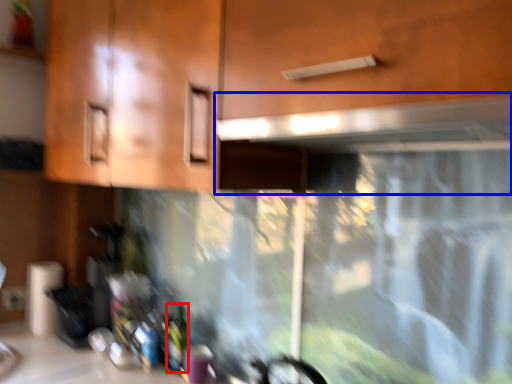
Question: Among these objects, which one is nearest to the camera, bottle (highlighted by a red box) or exhaust hood (highlighted by a blue box)?

Choices:
 (A) bottle
 (B) exhaust hood

Answer: (B)